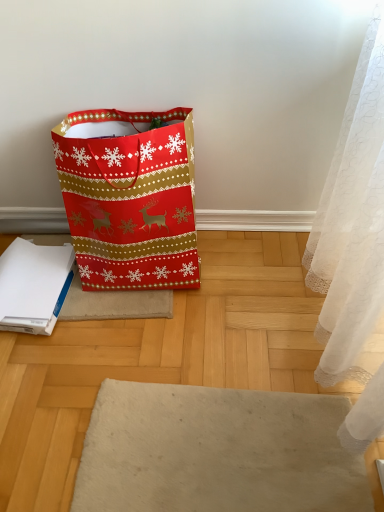
Find the location of a particular element. free space in front of shiny paper bag at left is located at coordinates (139, 351).